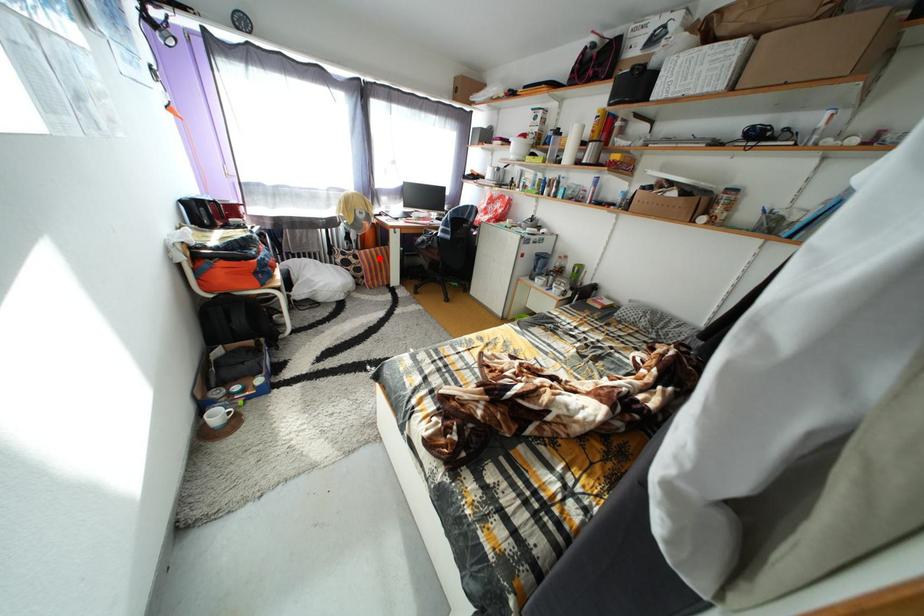
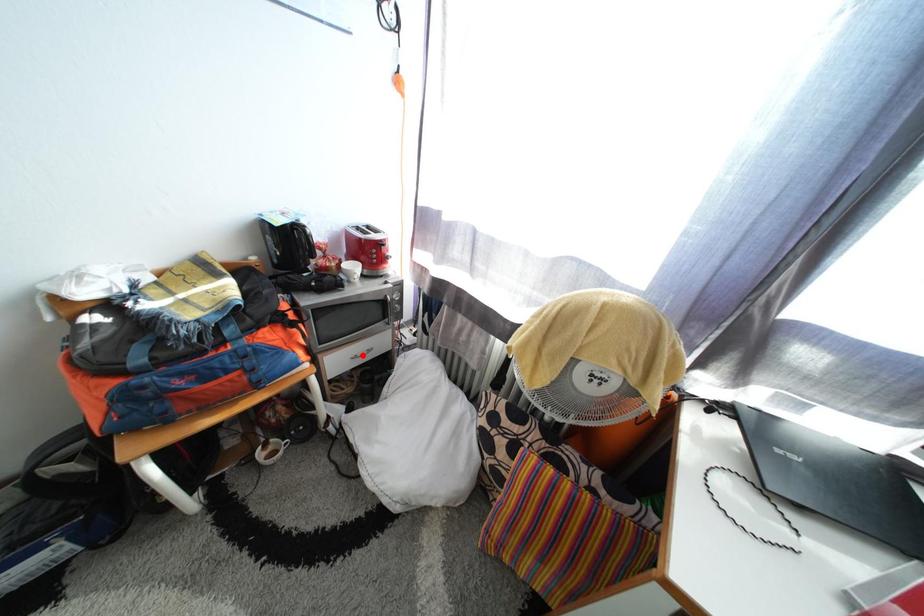
I am providing you with two images of the same scene from different viewpoints. A red point is marked on the first image and another point is marked on the second image. Does the point marked in image1 correspond to the same location as the one in image2?

No